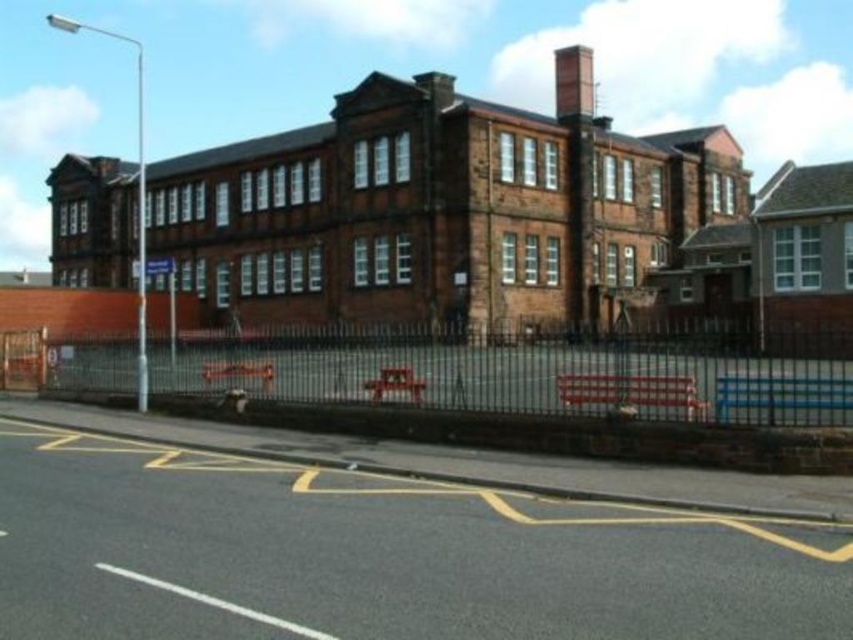
Question: Among these points, which one is farthest from the camera?

Choices:
 (A) (802, 394)
 (B) (558, 51)

Answer: (B)

Question: Where is black metal fence at lower center located in relation to smooth brick chimney at upper center in the image?

Choices:
 (A) right
 (B) left

Answer: (B)

Question: Which point is farther from the camera taking this photo?

Choices:
 (A) (434, 349)
 (B) (555, 112)

Answer: (B)

Question: Can you confirm if black metal fence at lower center is positioned below smooth brick chimney at upper center?

Choices:
 (A) no
 (B) yes

Answer: (B)

Question: Is the position of black metal fence at lower center more distant than that of smooth brick chimney at upper center?

Choices:
 (A) no
 (B) yes

Answer: (A)

Question: Among these points, which one is nearest to the camera?

Choices:
 (A) (566, 106)
 (B) (483, 342)

Answer: (B)